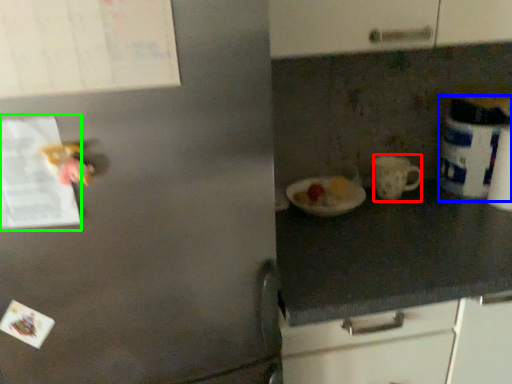
Question: Which object is positioned farthest from mug (highlighted by a red box)? Select from appliance (highlighted by a blue box) and paper (highlighted by a green box).

Choices:
 (A) appliance
 (B) paper

Answer: (B)